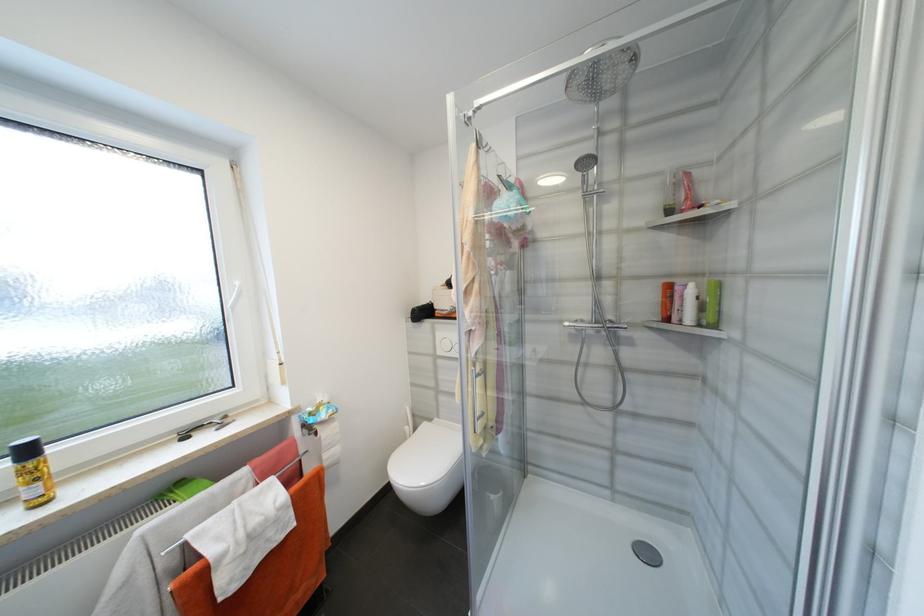
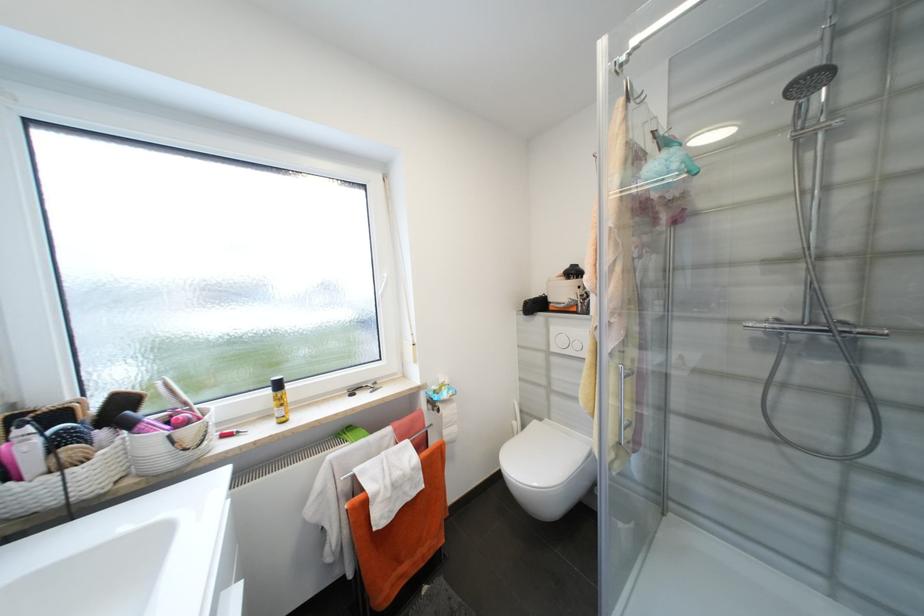
Locate, in the second image, the point that corresponds to point (322, 435) in the first image.

(444, 411)